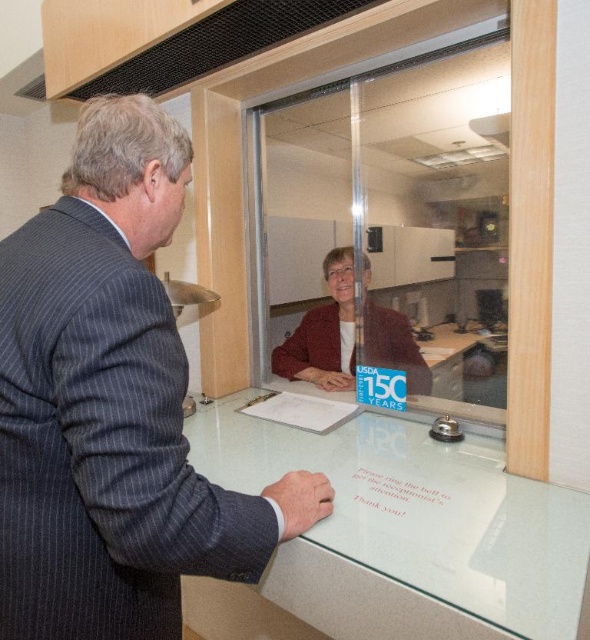
Which is in front, point (73, 627) or point (343, 328)?

Point (73, 627) is more forward.

Between dark gray pinstripe suit at center and matte black suit at center, which one appears on the right side from the viewer's perspective?

Positioned to the right is matte black suit at center.

Consider the image. Who is more distant from viewer, (63, 444) or (365, 323)?

The point (365, 323) is behind.

Identify the location of dark gray pinstripe suit at center. This screenshot has height=640, width=590. (113, 406).

Can you confirm if clear glass table at center is wider than matte black suit at center?

Correct, the width of clear glass table at center exceeds that of matte black suit at center.

Who is lower down, clear glass table at center or matte black suit at center?

clear glass table at center is lower down.

Between point (316, 552) and point (378, 314), which one is positioned in front?

Point (316, 552) is in front.

The image size is (590, 640). What are the coordinates of `clear glass table at center` in the screenshot? It's located at (396, 536).

Between point (224, 572) and point (460, 545), which one is positioned in front?

Positioned in front is point (224, 572).

Is dark gray pinstripe suit at center to the right of clear glass table at center from the viewer's perspective?

In fact, dark gray pinstripe suit at center is to the left of clear glass table at center.

Is point (35, 364) positioned in front of point (571, 524)?

Yes, point (35, 364) is in front of point (571, 524).

Locate an element on the screen. The width and height of the screenshot is (590, 640). dark gray pinstripe suit at center is located at coordinates (113, 406).